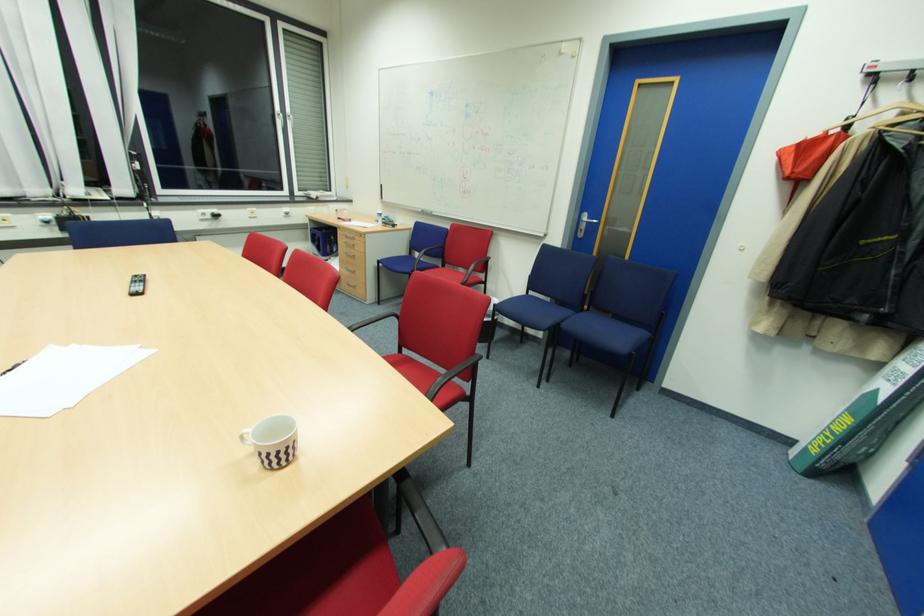
Where would you lift the patterned white mug? Please return your answer as a coordinate pair (x, y).

(246, 437)